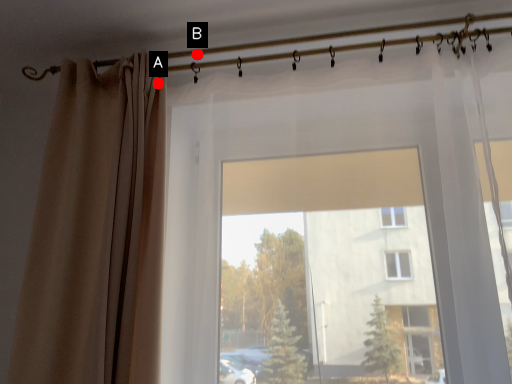
Question: Two points are circled on the image, labeled by A and B beside each circle. Which point is closer to the camera?

Choices:
 (A) A is closer
 (B) B is closer

Answer: (A)